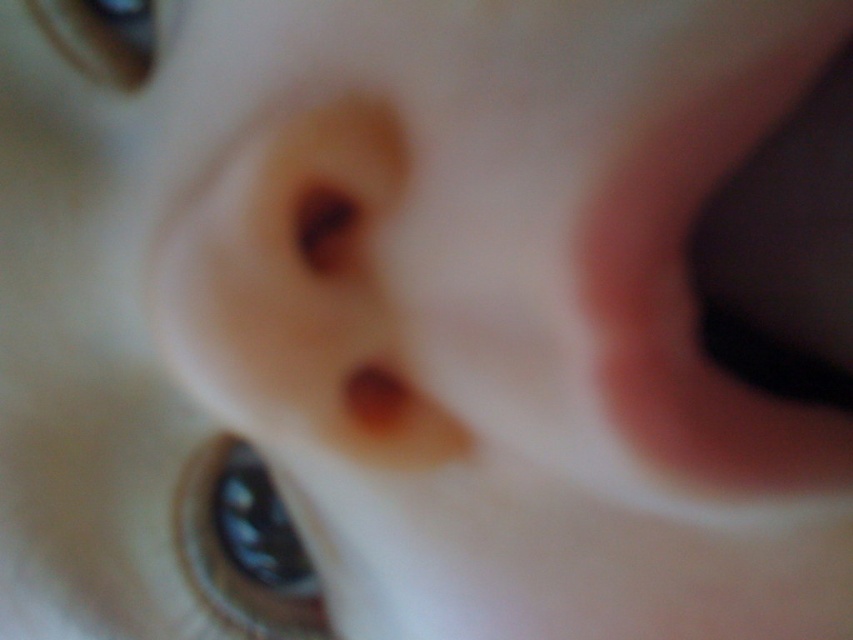
You are a photographer reviewing a blurry portrait. You notice two eyes in the image labeled as the satin black eye at center and the matte black eye at upper left. Which eye appears bigger in the photo?

The satin black eye at center appears bigger in the photo as it has a larger size compared to the matte black eye at upper left.

Consider the image. You are a photographer trying to adjust the focus of your camera. You notice two eyes in the image, the satin black eye at center and the matte black eye at upper left. Which eye is positioned higher in the frame?

The satin black eye at center is taller than matte black eye at upper left, so the satin black eye at center is positioned higher in the frame.